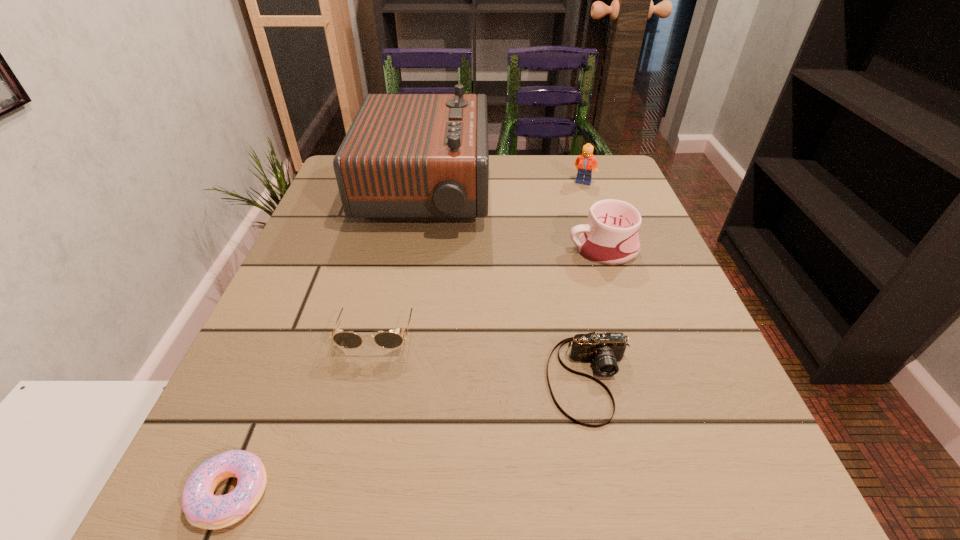
The height and width of the screenshot is (540, 960). In the image, there is a desktop. In order to click on vacant space at the right edge in this screenshot , I will do `click(596, 293)`.

This screenshot has height=540, width=960. I want to click on vacant region at the far right corner of the desktop, so click(x=619, y=175).

The image size is (960, 540). Identify the location of free location at the near right corner of the desktop. (743, 527).

Locate an element on the screen. Image resolution: width=960 pixels, height=540 pixels. free space between the third tallest object and the doughnut is located at coordinates (417, 372).

At what (x,y) coordinates should I click in order to perform the action: click on free space between the nearest object and the tallest object. Please return your answer as a coordinate pair (x, y). The width and height of the screenshot is (960, 540). Looking at the image, I should click on (328, 343).

The image size is (960, 540). What are the coordinates of `empty space that is in between the fifth tallest object and the sunglasses` in the screenshot? It's located at (484, 355).

Locate an element on the screen. Image resolution: width=960 pixels, height=540 pixels. free point between the nearest object and the tallest object is located at coordinates click(328, 343).

At what (x,y) coordinates should I click in order to perform the action: click on vacant area between the camera and the Lego. Please return your answer as a coordinate pair (x, y). The width and height of the screenshot is (960, 540). Looking at the image, I should click on (587, 281).

At what (x,y) coordinates should I click in order to perform the action: click on free spot between the Lego and the fourth tallest object. Please return your answer as a coordinate pair (x, y). The width and height of the screenshot is (960, 540). Looking at the image, I should click on (480, 256).

I want to click on empty location between the fifth tallest object and the fourth tallest object, so click(484, 355).